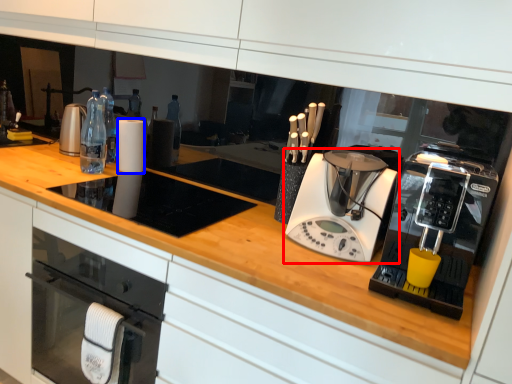
Question: Which object is further to the camera taking this photo, home appliance (highlighted by a red box) or paper towel (highlighted by a blue box)?

Choices:
 (A) home appliance
 (B) paper towel

Answer: (B)